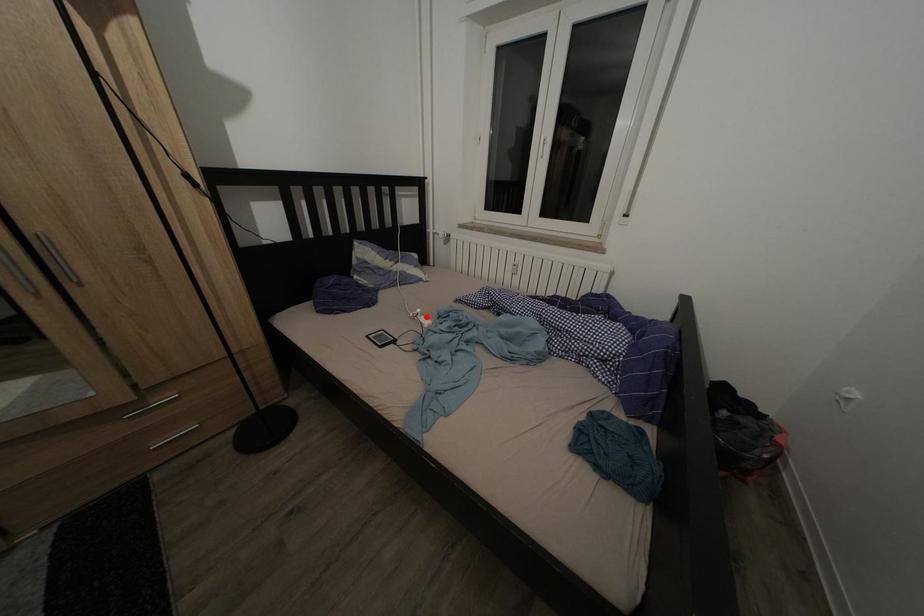
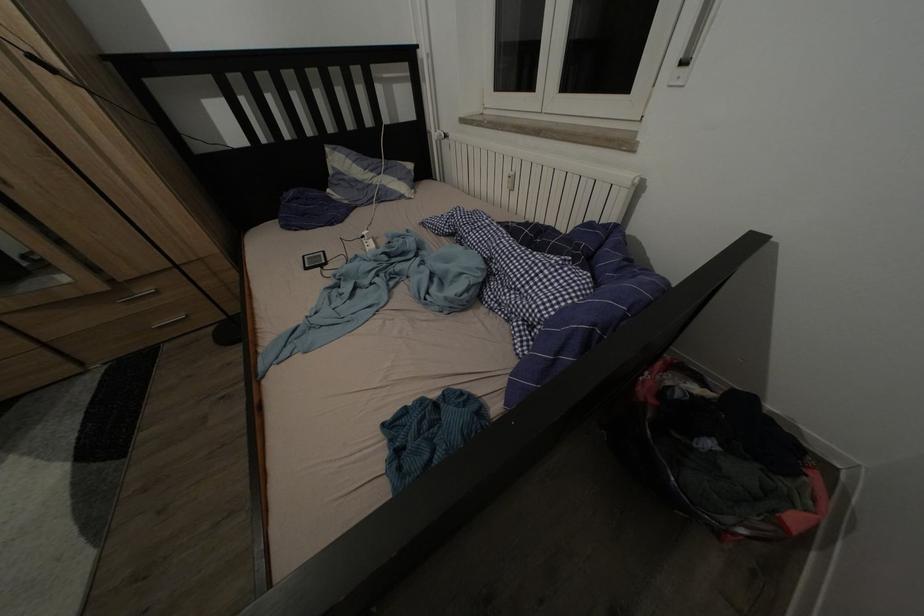
Question: I am providing you with two images of the same scene from different viewpoints. Given a red point in image1, look at the same physical point in image2. Is it:

Choices:
 (A) Closer to the viewpoint
 (B) Farther from the viewpoint

Answer: (B)